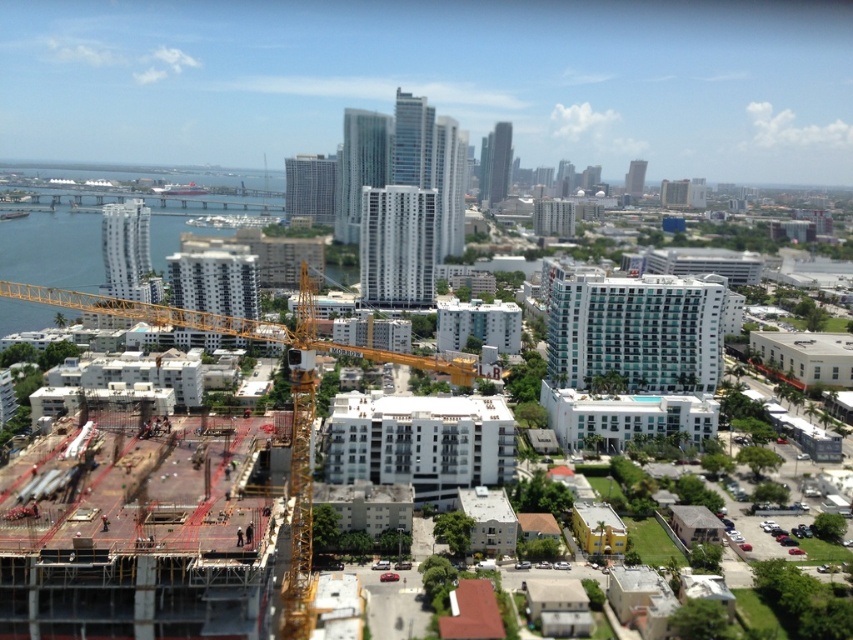
You are standing at the point labeled as point (97, 234) in the image. What do you see directly in front of you?

You see blue glass water at left directly in front of you at point (97, 234).